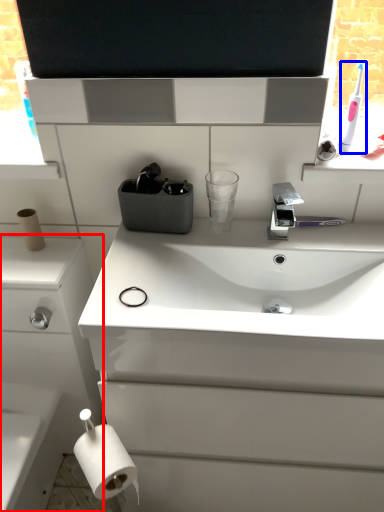
Question: Which point is closer to the camera, bathroom cabinet (highlighted by a red box) or toothbrush (highlighted by a blue box)?

Choices:
 (A) bathroom cabinet
 (B) toothbrush

Answer: (A)